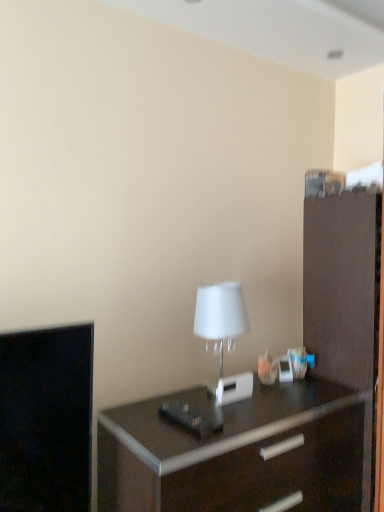
Locate an element on the screen. The height and width of the screenshot is (512, 384). white matte table lamp at center is located at coordinates (224, 333).

From the picture: Does white matte table lamp at center lie behind brown matte file cabinet at right?

No, the depth of white matte table lamp at center is less than that of brown matte file cabinet at right.

From the image's perspective, is white matte table lamp at center above or below brown matte file cabinet at right?

Based on their image positions, white matte table lamp at center is located above brown matte file cabinet at right.

Does point (225, 297) appear closer or farther from the camera than point (317, 210)?

Point (225, 297) is closer to the camera than point (317, 210).

From a real-world perspective, between white matte table lamp at center and brown matte file cabinet at right, who is vertically higher?

In real-world perspective, white matte table lamp at center is above.

Locate an element on the screen. The width and height of the screenshot is (384, 512). table lamp in front of the brown matte file cabinet at right is located at coordinates (224, 333).

Looking at this image, looking at their sizes, would you say brown matte file cabinet at right is wider or thinner than white matte table lamp at center?

Clearly, brown matte file cabinet at right has more width compared to white matte table lamp at center.

Measure the distance between brown matte file cabinet at right and white matte table lamp at center.

brown matte file cabinet at right and white matte table lamp at center are 19.82 inches apart from each other.

Is brown matte file cabinet at right taller than white matte table lamp at center?

Indeed, brown matte file cabinet at right has a greater height compared to white matte table lamp at center.

You are a GUI agent. You are given a task and a screenshot of the screen. Output one action in this format:
    pyautogui.click(x=<x>, y=<y>)
    Task: Click on the chest of drawers on the left of brown matte file cabinet at right
    The height and width of the screenshot is (512, 384).
    Given the screenshot: What is the action you would take?
    pyautogui.click(x=240, y=452)

Is brown matte file cabinet at right positioned far away from dark wood chest of drawers at center?

brown matte file cabinet at right is near dark wood chest of drawers at center, not far away.

Considering the sizes of brown matte file cabinet at right and dark wood chest of drawers at center in the image, is brown matte file cabinet at right wider or thinner than dark wood chest of drawers at center?

In the image, brown matte file cabinet at right appears to be more narrow than dark wood chest of drawers at center.

From the picture: Are dark wood chest of drawers at center and white matte table lamp at center located far from each other?

No.

Which of these two, dark wood chest of drawers at center or white matte table lamp at center, stands taller?

dark wood chest of drawers at center.

Based on the photo, from a real-world perspective, which object rests below the other?

dark wood chest of drawers at center, from a real-world perspective.

Between point (134, 420) and point (378, 249), which one is positioned in front?

The point (134, 420) is in front.

Based on the photo, how different are the orientations of dark wood chest of drawers at center and brown matte file cabinet at right in degrees?

The facing directions of dark wood chest of drawers at center and brown matte file cabinet at right are 1.02 degrees apart.

Which is more to the left, dark wood chest of drawers at center or brown matte file cabinet at right?

dark wood chest of drawers at center is more to the left.

Which point is more distant from viewer, (221, 328) or (301, 404)?

Point (301, 404)

Between white matte table lamp at center and dark wood chest of drawers at center, which one is positioned in front?

dark wood chest of drawers at center is more forward.

Between white matte table lamp at center and dark wood chest of drawers at center, which one appears on the left side from the viewer's perspective?

white matte table lamp at center.

Could you tell me if white matte table lamp at center is turned towards dark wood chest of drawers at center?

No, white matte table lamp at center is not facing towards dark wood chest of drawers at center.

Find the location of `table lamp in front of the brown matte file cabinet at right`. table lamp in front of the brown matte file cabinet at right is located at coordinates (224, 333).

There is a brown matte file cabinet at right. Where is `table lamp above it (from a real-world perspective)`? This screenshot has width=384, height=512. table lamp above it (from a real-world perspective) is located at coordinates (224, 333).

Estimate the real-world distances between objects in this image. Which object is closer to dark wood chest of drawers at center, white matte table lamp at center or brown matte file cabinet at right?

brown matte file cabinet at right.

Based on their spatial positions, is brown matte file cabinet at right or white matte table lamp at center closer to dark wood chest of drawers at center?

brown matte file cabinet at right is closer to dark wood chest of drawers at center.

Estimate the real-world distances between objects in this image. Which object is further from brown matte file cabinet at right, white matte table lamp at center or dark wood chest of drawers at center?

white matte table lamp at center is positioned further to the anchor brown matte file cabinet at right.

Looking at the image, which one is located closer to white matte table lamp at center, dark wood chest of drawers at center or brown matte file cabinet at right?

The object closer to white matte table lamp at center is dark wood chest of drawers at center.

Looking at the image, which one is located further to white matte table lamp at center, brown matte file cabinet at right or dark wood chest of drawers at center?

Based on the image, brown matte file cabinet at right appears to be further to white matte table lamp at center.

Based on their spatial positions, is dark wood chest of drawers at center or white matte table lamp at center closer to brown matte file cabinet at right?

Based on the image, dark wood chest of drawers at center appears to be nearer to brown matte file cabinet at right.

Locate an element on the screen. This screenshot has height=512, width=384. chest of drawers between white matte table lamp at center and brown matte file cabinet at right from left to right is located at coordinates (240, 452).